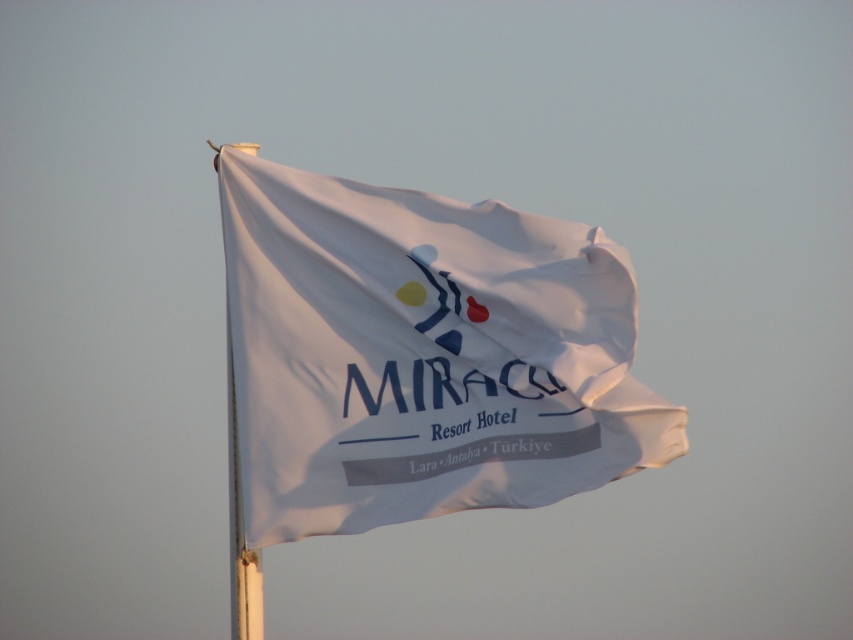
You are standing in front of the flagpole and want to hang a new banner below the existing white fabric flag at center. According to the flagpole layout, where should you place the new banner to ensure it is positioned below the current flag?

The white fabric flag at center is located at point (422, 355), so you should place the new banner below this coordinate to ensure it is positioned below the current flag.

You are standing in front of a resort hotel and see the white fabric flag at center and the white fabric flagpole at left. Which object is positioned to the right of the other?

The white fabric flag at center is positioned to the right of the white fabric flagpole at left.

You are a photographer standing in front of the white fabric flag at center and the white fabric flagpole at left. Which object is nearer to you?

The white fabric flag at center is closer to the viewer than the white fabric flagpole at left.